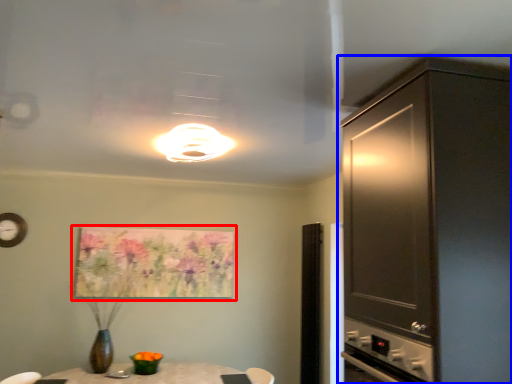
Question: Which object is closer to the camera taking this photo, picture frame (highlighted by a red box) or cabinetry (highlighted by a blue box)?

Choices:
 (A) picture frame
 (B) cabinetry

Answer: (B)